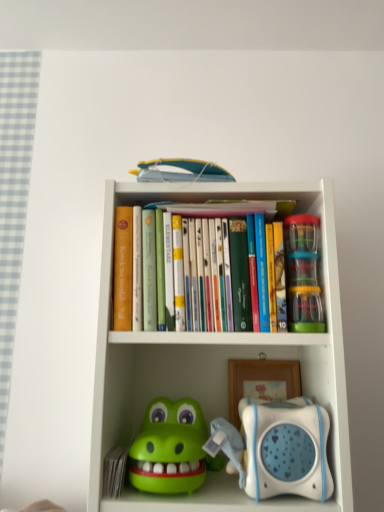
Describe the element at coordinates (303, 274) in the screenshot. I see `translucent plastic stacking cups at upper right` at that location.

The height and width of the screenshot is (512, 384). Identify the location of translucent plastic stacking cups at upper right. (303, 274).

At what (x,y) coordinates should I click in order to perform the action: click on translucent plastic stacking cups at upper right. Please return your answer as a coordinate pair (x, y). The height and width of the screenshot is (512, 384). Looking at the image, I should click on (303, 274).